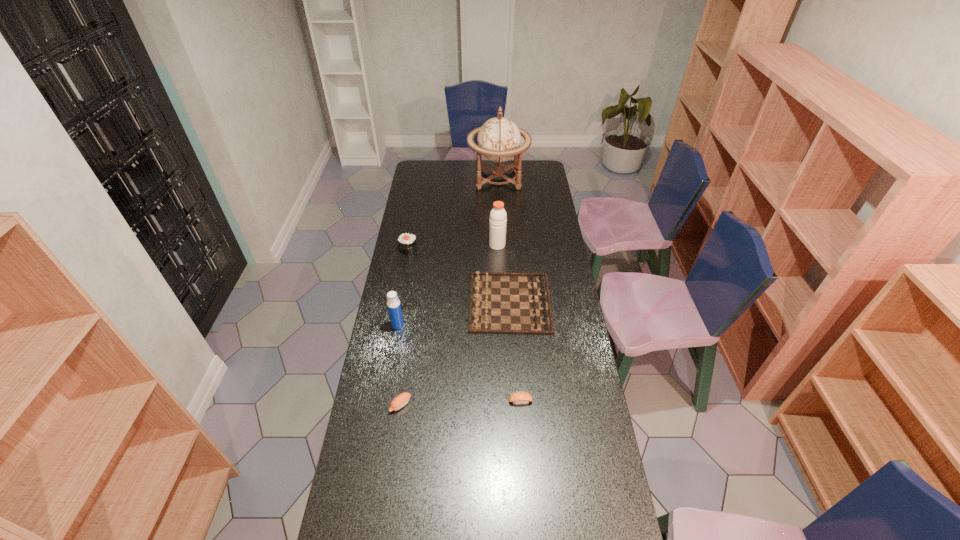
Locate an element on the screen. vacant space that satisfies the following two spatial constraints: 1. on the back side of the tallest sushi; 2. on the right side of the sixth shortest object is located at coordinates (409, 245).

The image size is (960, 540). Find the location of `vacant area in the image that satisfies the following two spatial constraints: 1. on the front side of the rightmost sushi; 2. on the right side of the farthest sushi`. vacant area in the image that satisfies the following two spatial constraints: 1. on the front side of the rightmost sushi; 2. on the right side of the farthest sushi is located at coordinates (381, 401).

The image size is (960, 540). What are the coordinates of `free space in the image that satisfies the following two spatial constraints: 1. on the front side of the chessboard; 2. on the right side of the farthest sushi` in the screenshot? It's located at (399, 302).